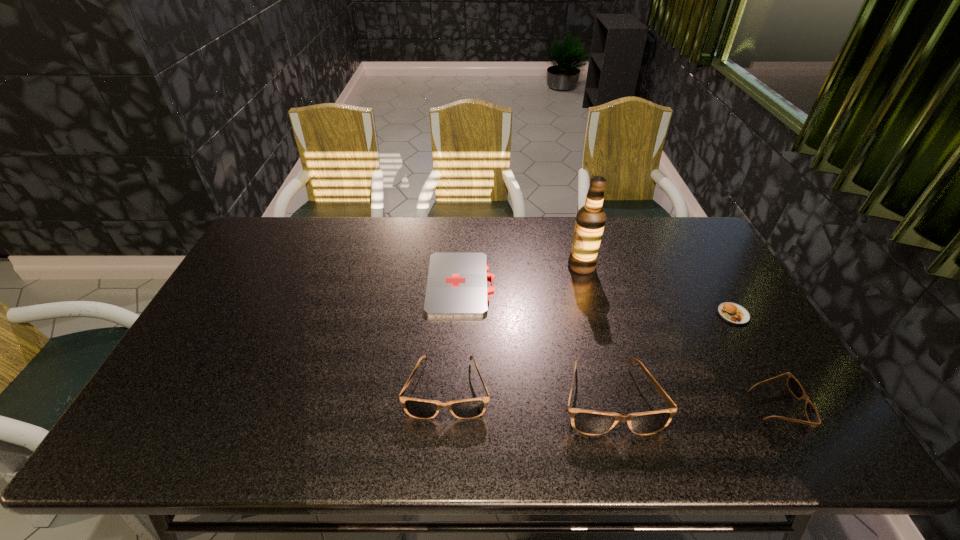
Please show where to add a sunglasses on the left while keeping spacing even. Please provide its 2D coordinates. Your answer should be formatted as a tuple, i.e. [(x, y)], where the tuple contains the x and y coordinates of a point satisfying the conditions above.

[(290, 380)]